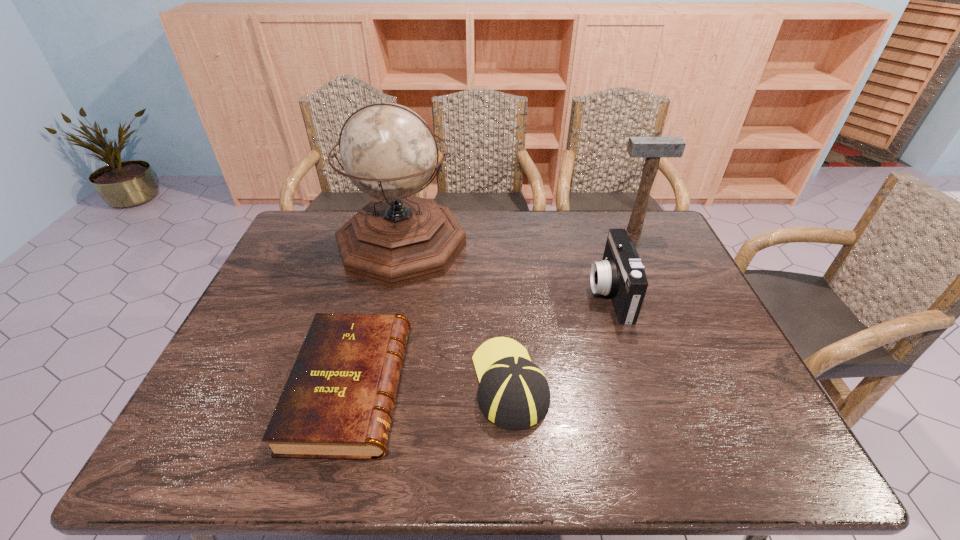
You are a GUI agent. You are given a task and a screenshot of the screen. Output one action in this format:
    pyautogui.click(x=<x>, y=<y>)
    Task: Click on the vacant space situated on the lens of the camcorder
    The width and height of the screenshot is (960, 540).
    Given the screenshot: What is the action you would take?
    pyautogui.click(x=480, y=294)

Identify the location of vacant space situated 0.350m on the lens of the camcorder. The height and width of the screenshot is (540, 960). (470, 294).

Locate an element on the screen. The image size is (960, 540). free location located 0.050m on the lens of the camcorder is located at coordinates (573, 294).

Where is `vacant space located with the brim of the baseball cap facing forward`? vacant space located with the brim of the baseball cap facing forward is located at coordinates pyautogui.click(x=504, y=290).

Where is `vacant space situated 0.310m with the brim of the baseball cap facing forward`? This screenshot has width=960, height=540. vacant space situated 0.310m with the brim of the baseball cap facing forward is located at coordinates (503, 266).

This screenshot has width=960, height=540. Identify the location of free space located with the brim of the baseball cap facing forward. (506, 322).

Locate an element on the screen. The image size is (960, 540). vacant region located on the back of the hardback book is located at coordinates (375, 293).

What are the coordinates of `globe that is at the far edge` in the screenshot? It's located at (388, 151).

Locate an element on the screen. This screenshot has width=960, height=540. mallet positioned at the far edge is located at coordinates (652, 148).

Where is `baseball cap that is at the near edge`? Image resolution: width=960 pixels, height=540 pixels. baseball cap that is at the near edge is located at coordinates (513, 393).